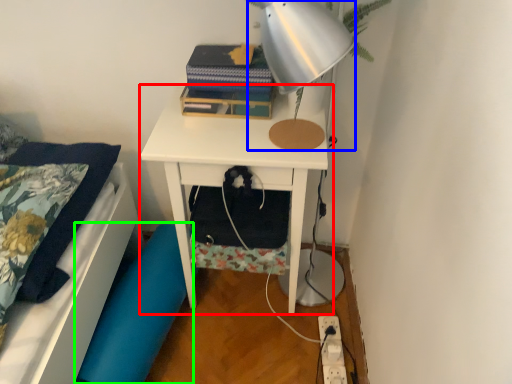
Question: Based on their relative distances, which object is nearer to nightstand (highlighted by a red box)? Choose from lamp (highlighted by a blue box) and swivel chair (highlighted by a green box).

Choices:
 (A) lamp
 (B) swivel chair

Answer: (B)